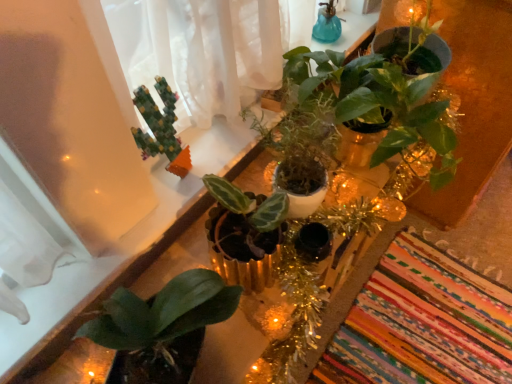
The height and width of the screenshot is (384, 512). In order to click on empty space that is ontop of multicolored woven mat at lower right (from a real-world perspective) in this screenshot , I will do `click(424, 332)`.